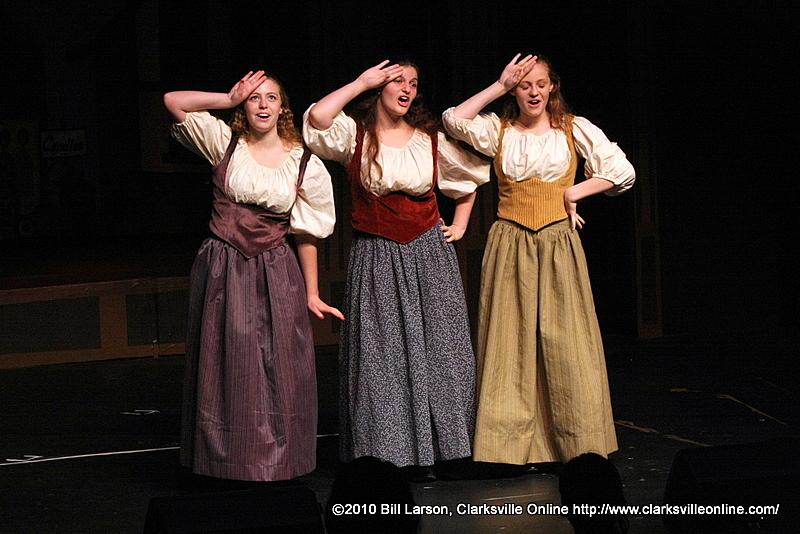
Find the location of a particular element. Image resolution: width=800 pixels, height=534 pixels. stage is located at coordinates (149, 438).